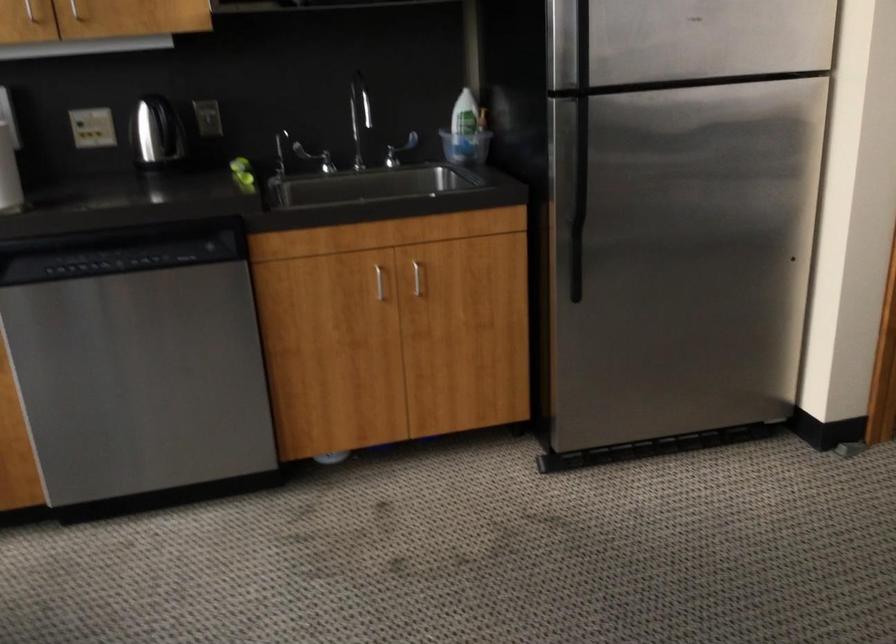
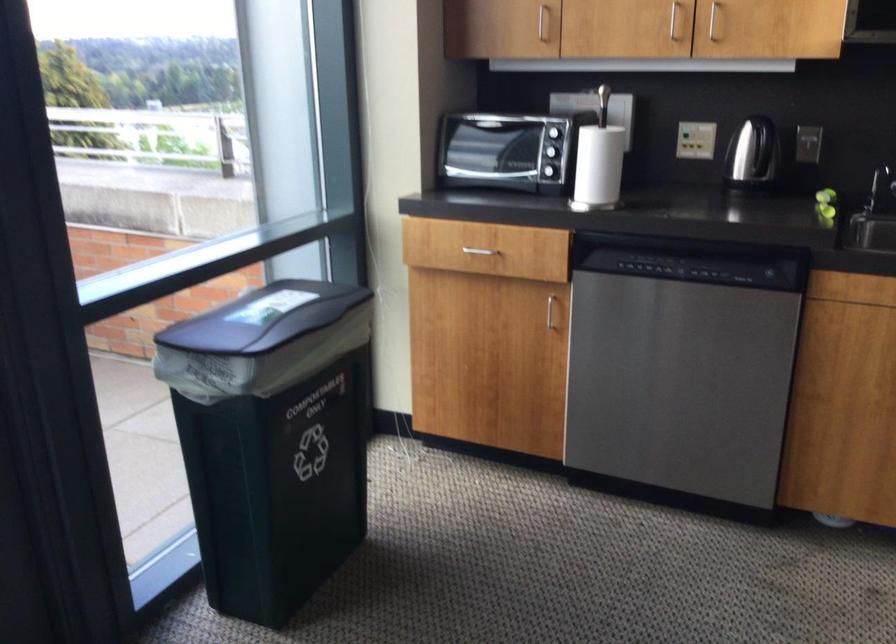
Where in the second image is the point corresponding to (x=161, y=136) from the first image?

(752, 152)